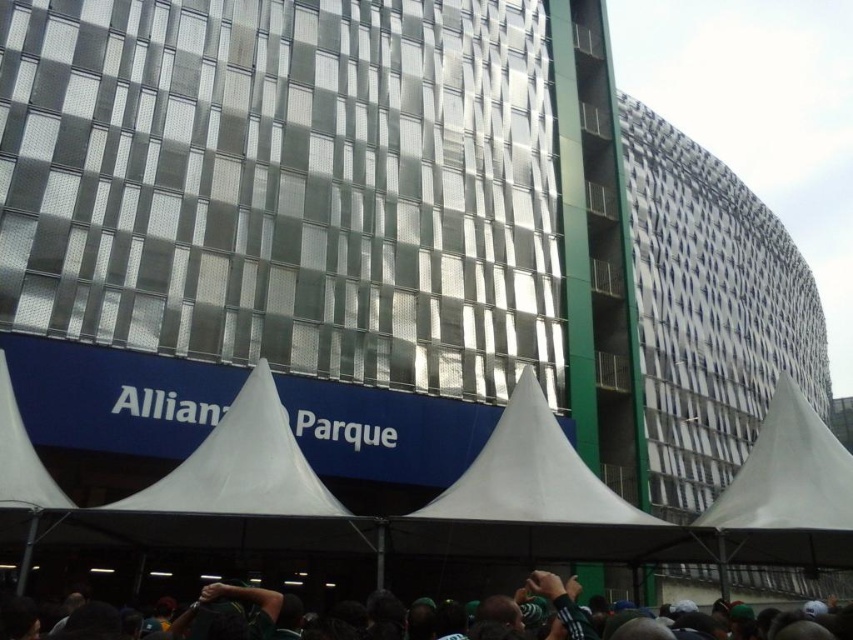
Question: Can you confirm if dark green fabric at lower center is bigger than white fabric canopy at lower left?

Choices:
 (A) no
 (B) yes

Answer: (B)

Question: Does dark green fabric at lower center have a smaller size compared to white fabric canopy at lower left?

Choices:
 (A) yes
 (B) no

Answer: (B)

Question: Which of the following is the closest to the observer?

Choices:
 (A) white fabric canopy at lower left
 (B) dark green fabric at lower center

Answer: (B)

Question: Which of the following is the farthest from the observer?

Choices:
 (A) white fabric canopy at lower left
 (B) dark green fabric at lower center

Answer: (A)

Question: In this image, where is dark green fabric at lower center located relative to white fabric canopy at lower left?

Choices:
 (A) above
 (B) below

Answer: (B)

Question: Which point is farther to the camera?

Choices:
 (A) white fabric canopy at lower left
 (B) dark green fabric at lower center

Answer: (A)